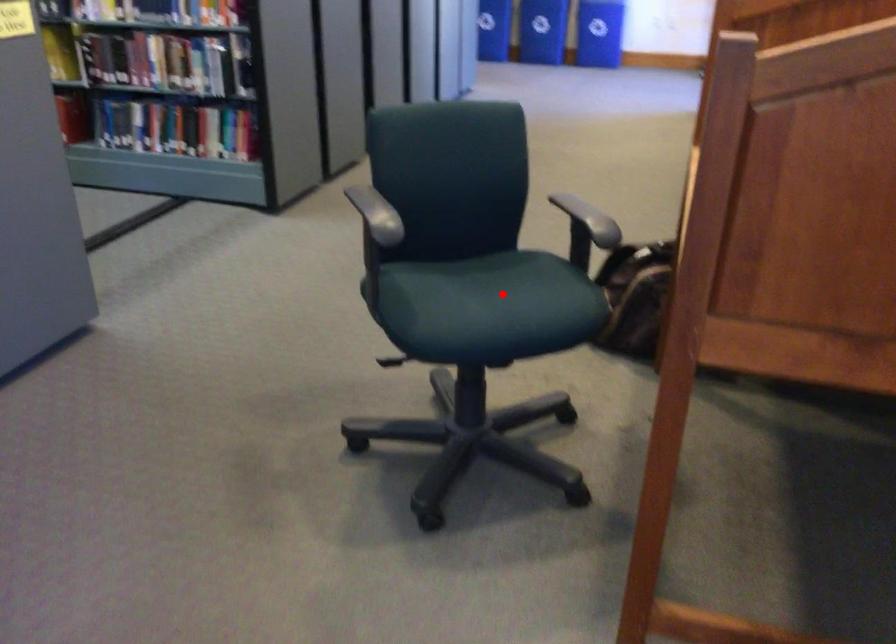
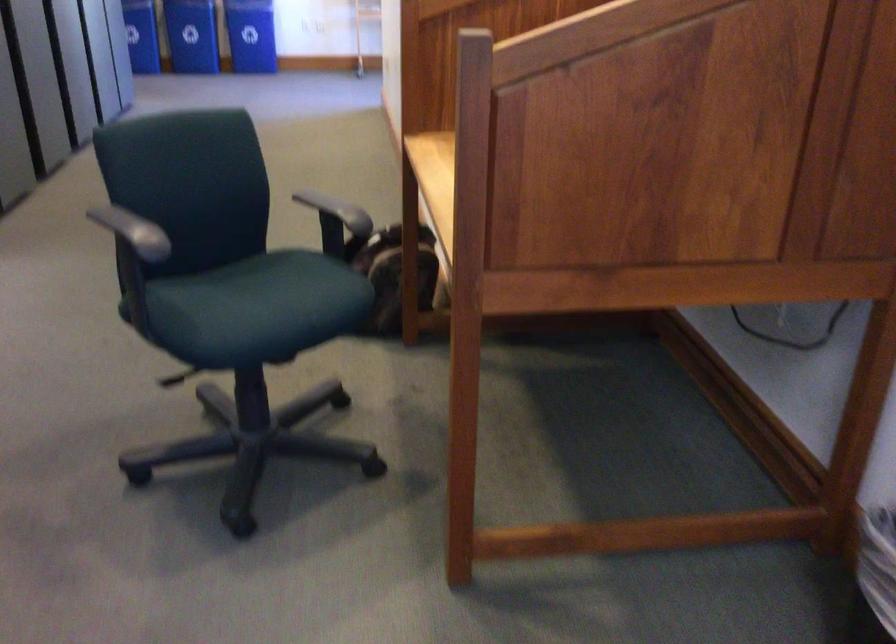
The point at the highlighted location is marked in the first image. Where is the corresponding point in the second image?

(277, 295)